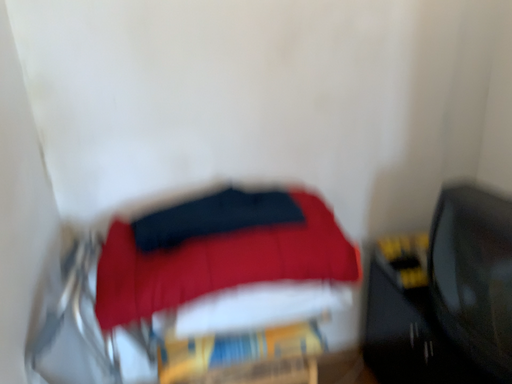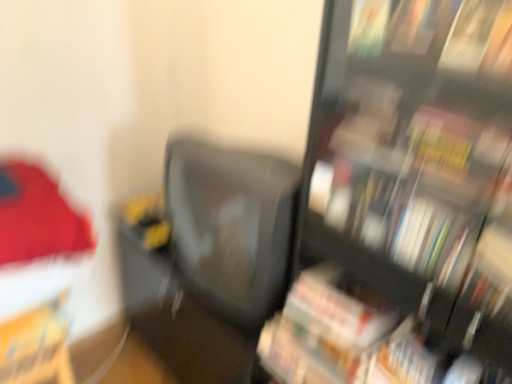
Question: How did the camera likely rotate when shooting the video?

Choices:
 (A) rotated right
 (B) rotated left

Answer: (A)